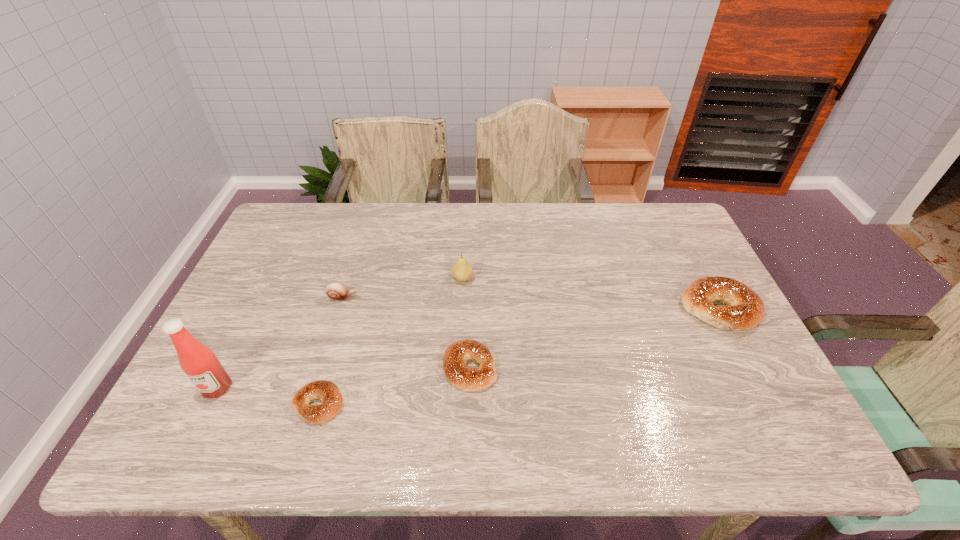
Please point a space for a new bagel to maintain equal intervals. Please provide its 2D coordinates. Your answer should be formatted as a tuple, i.e. [(x, y)], where the tuple contains the x and y coordinates of a point satisfying the conditions above.

[(602, 336)]